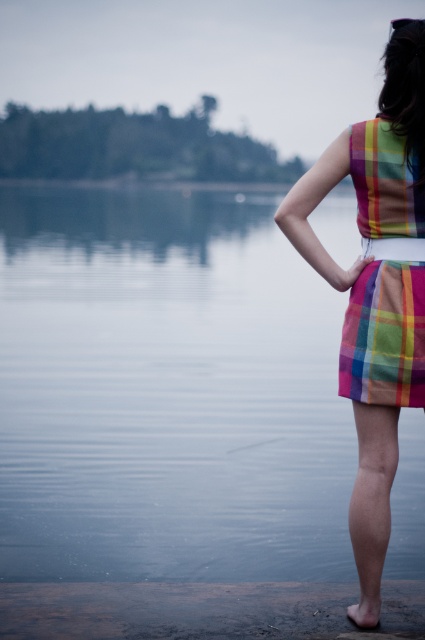
Question: Among these points, which one is farthest from the camera?

Choices:
 (A) (421, 305)
 (B) (133, 544)

Answer: (B)

Question: Estimate the real-world distances between objects in this image. Which object is farther from the plaid fabric dress at right?

Choices:
 (A) transparent water at center
 (B) plaid fabric dress at center

Answer: (A)

Question: Is transparent water at center above plaid fabric dress at center?

Choices:
 (A) yes
 (B) no

Answer: (A)

Question: Which object appears closest to the camera in this image?

Choices:
 (A) plaid fabric dress at center
 (B) plaid fabric dress at right

Answer: (B)

Question: From the image, what is the correct spatial relationship of plaid fabric dress at right in relation to plaid fabric dress at center?

Choices:
 (A) left
 (B) right

Answer: (A)

Question: Does plaid fabric dress at right appear on the left side of plaid fabric dress at center?

Choices:
 (A) yes
 (B) no

Answer: (A)